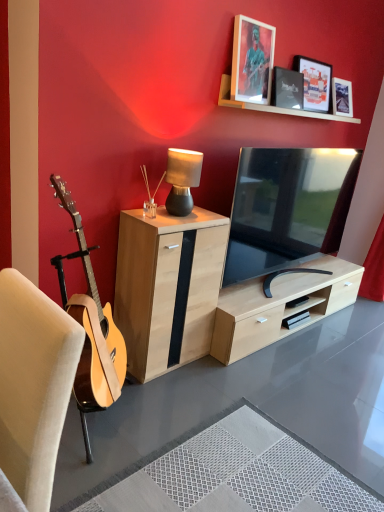
Locate an element on the screen. This screenshot has height=512, width=384. empty space that is ontop of white textured rug at lower center (from a real-world perspective) is located at coordinates pyautogui.click(x=244, y=471).